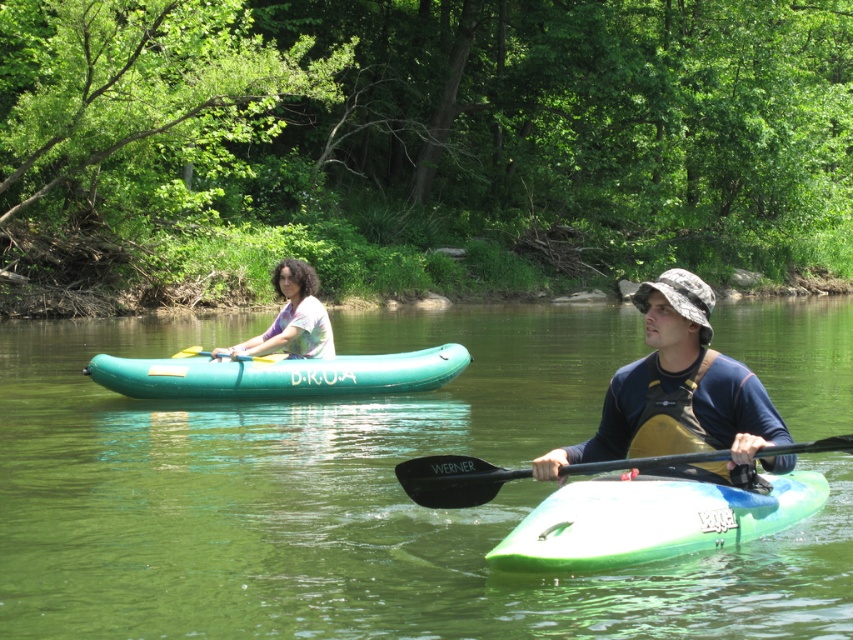
You are a photographer taking a picture of the camouflage fabric hat at center and the teal rubber canoe at center. Which object will appear larger in the photo?

The camouflage fabric hat at center will appear larger in the photo because it is closer to the camera than the teal rubber canoe at center.